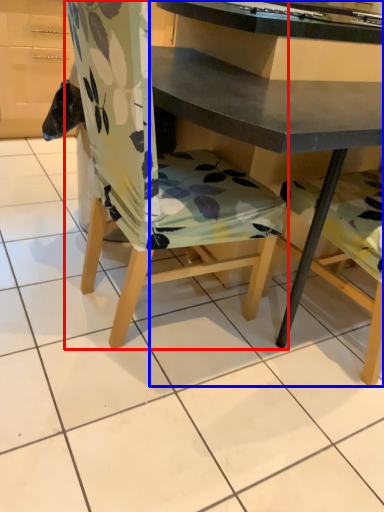
Question: Among these objects, which one is nearest to the camera, chair (highlighted by a red box) or desk (highlighted by a blue box)?

Choices:
 (A) chair
 (B) desk

Answer: (A)